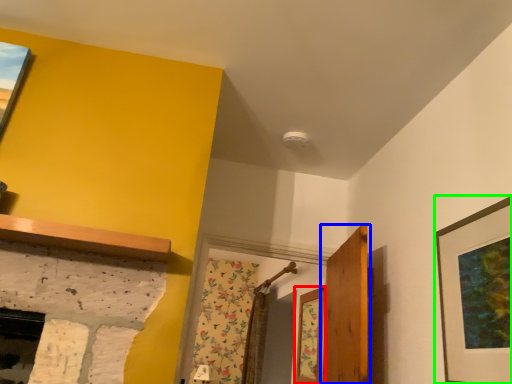
Question: Based on their relative distances, which object is nearer to window (highlighted by a red box)? Choose from door (highlighted by a blue box) and picture frame (highlighted by a green box).

Choices:
 (A) door
 (B) picture frame

Answer: (A)